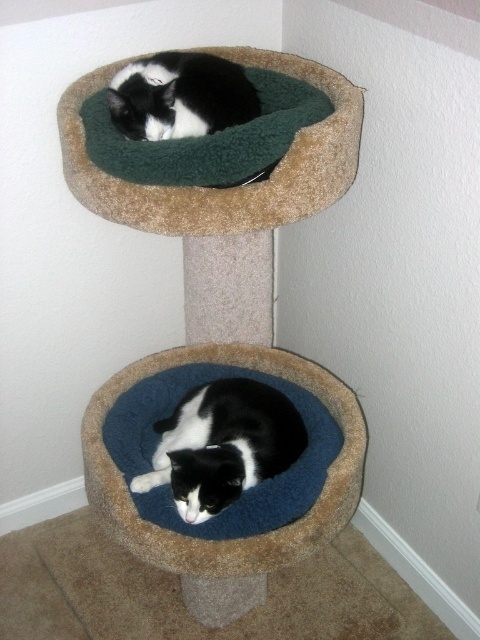
You are a cat owner trying to locate your two cats. You see the green plush cat bed at upper center and the blue fuzzy cat bed at lower center. Which cat bed is positioned to the left side of the other?

The green plush cat bed at upper center is to the left of the blue fuzzy cat bed at lower center.

You are a cat owner trying to decide which cat bed to place a new toy. The green plush cat bed at upper center and the blue fuzzy cat bed at lower center are options. Which cat bed is closer to you?

The green plush cat bed at upper center is closer to you than the blue fuzzy cat bed at lower center.

You are a cat owner trying to locate your cat. You see the blue fuzzy cat bed at lower center and the black and white fur cat at lower center. Which direction should you look to find the cat relative to the cat bed?

The black and white fur cat at lower center is to the left of the blue fuzzy cat bed at lower center, so you should look to the left side of the cat bed to find the cat.